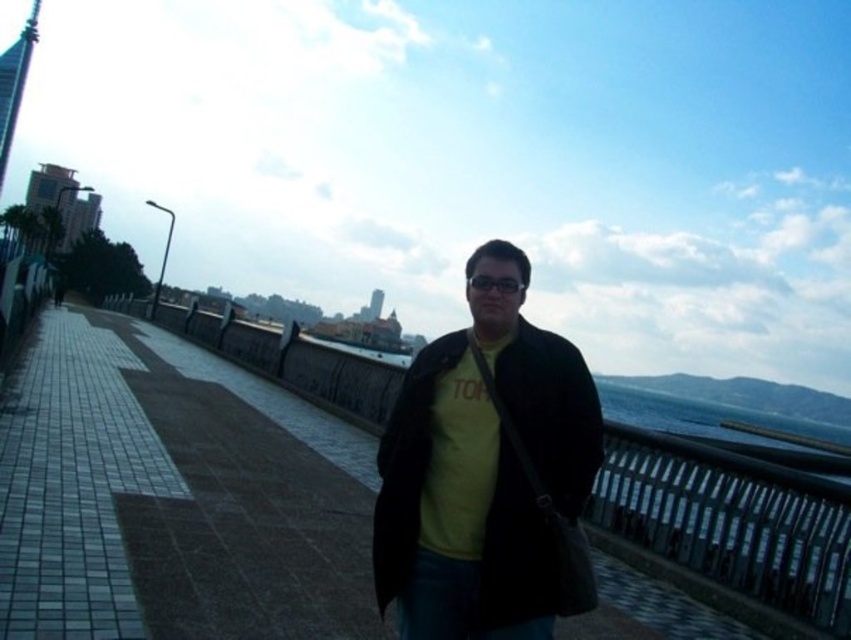
Who is shorter, yellow matte shirt at center or black metal rail at center?

yellow matte shirt at center is shorter.

This screenshot has height=640, width=851. What do you see at coordinates (457, 509) in the screenshot?
I see `yellow matte shirt at center` at bounding box center [457, 509].

The image size is (851, 640). Identify the location of yellow matte shirt at center. [x=457, y=509].